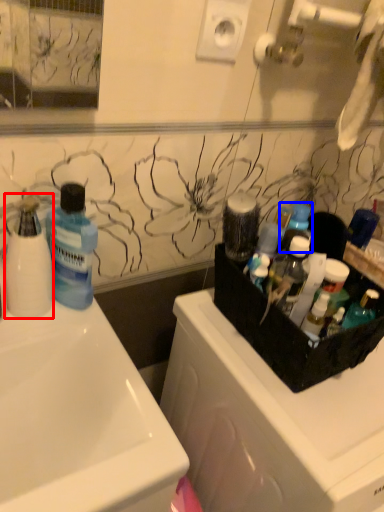
Question: Which object appears closest to the camera in this image, cleaning product (highlighted by a red box) or toiletry (highlighted by a blue box)?

Choices:
 (A) cleaning product
 (B) toiletry

Answer: (A)